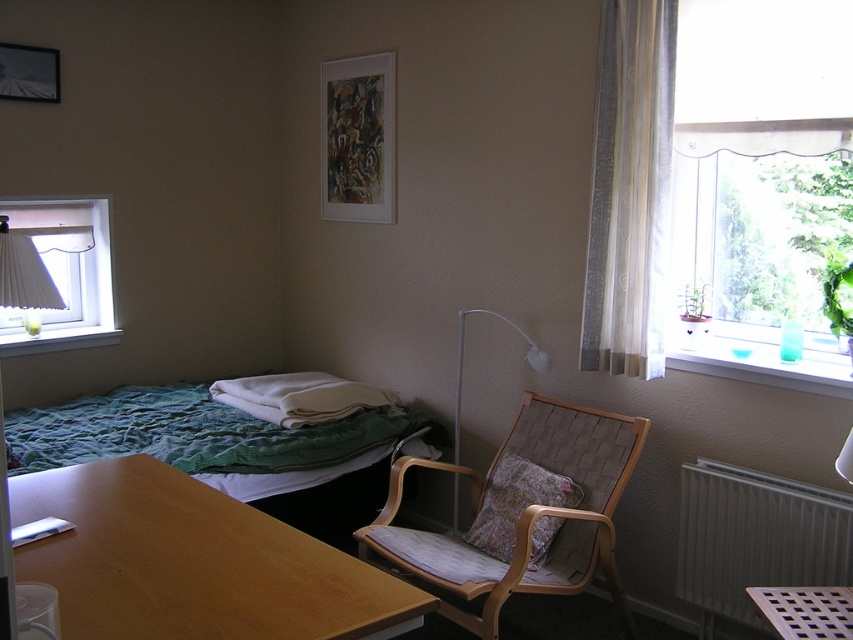
You are a delivery person who needs to place a package on a surface near the floral fabric pillow at center. Is the wooden table at lower left close enough to place the package there?

The wooden table at lower left is 3.82 feet away from the floral fabric pillow at center. Since the distance is more than a typical person can reach, the package would need to be carried to the table rather than placed directly.

You are standing in the room and want to place a small decorative item on the point closer to you between the two points labeled as point (780, 572) and point (550, 536). Which point should you choose?

You should choose point (780, 572) because it is closer to the viewer than point (550, 536).